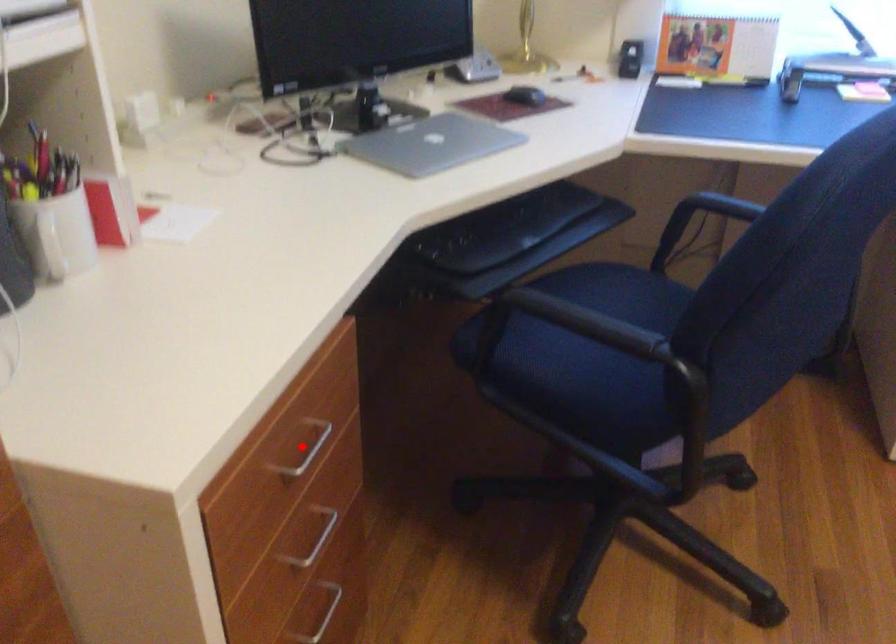
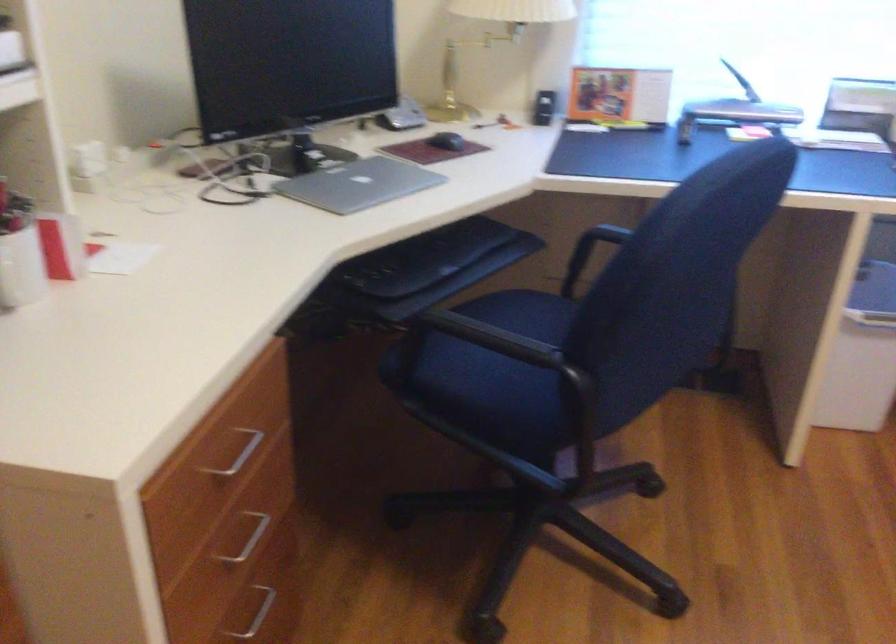
In the second image, find the point that corresponds to the highlighted location in the first image.

(238, 453)